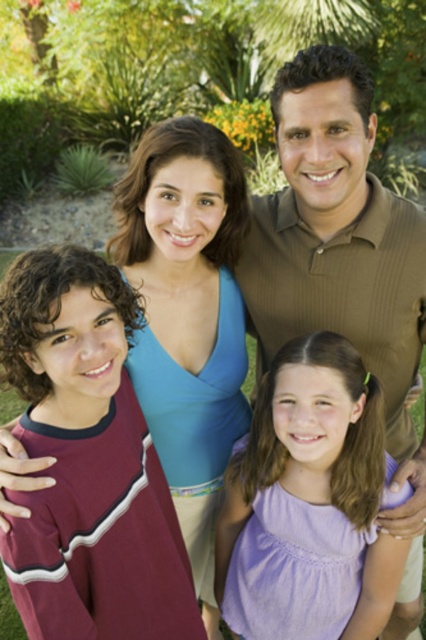
Question: Does brown textured shirt at upper center appear over purple cotton dress at center?

Choices:
 (A) no
 (B) yes

Answer: (B)

Question: Does brown textured shirt at upper center appear on the right side of blue fabric dress at upper center?

Choices:
 (A) no
 (B) yes

Answer: (B)

Question: Can you confirm if brown textured shirt at upper center is smaller than blue fabric dress at upper center?

Choices:
 (A) no
 (B) yes

Answer: (B)

Question: Which object is the closest to the purple cotton dress at center?

Choices:
 (A) blue fabric dress at upper center
 (B) brown textured shirt at upper center

Answer: (B)

Question: Which of the following is the farthest from the observer?

Choices:
 (A) click(331, 323)
 (B) click(190, 152)
 (C) click(304, 509)

Answer: (A)

Question: Which of the following is the farthest from the observer?

Choices:
 (A) (397, 323)
 (B) (362, 397)
 (C) (210, 259)

Answer: (C)